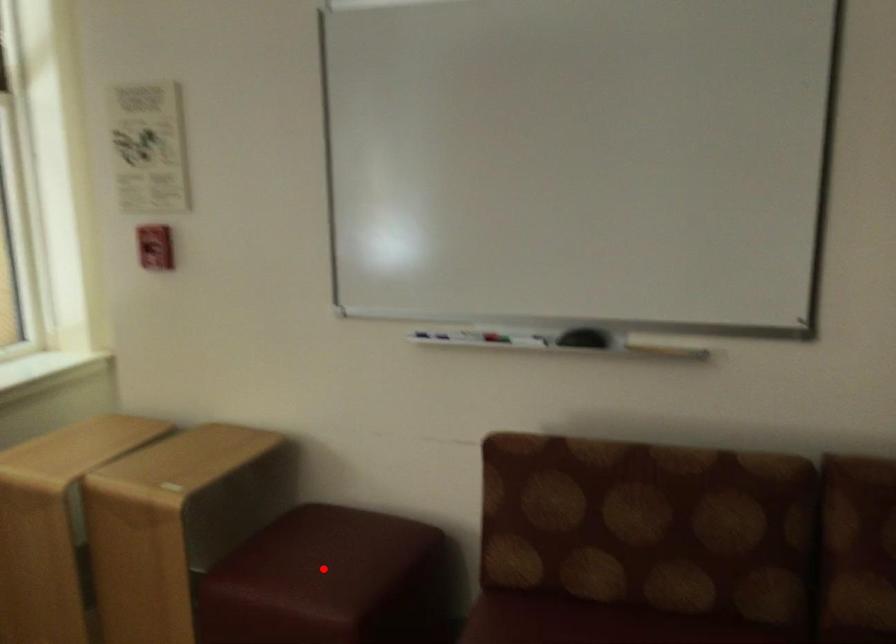
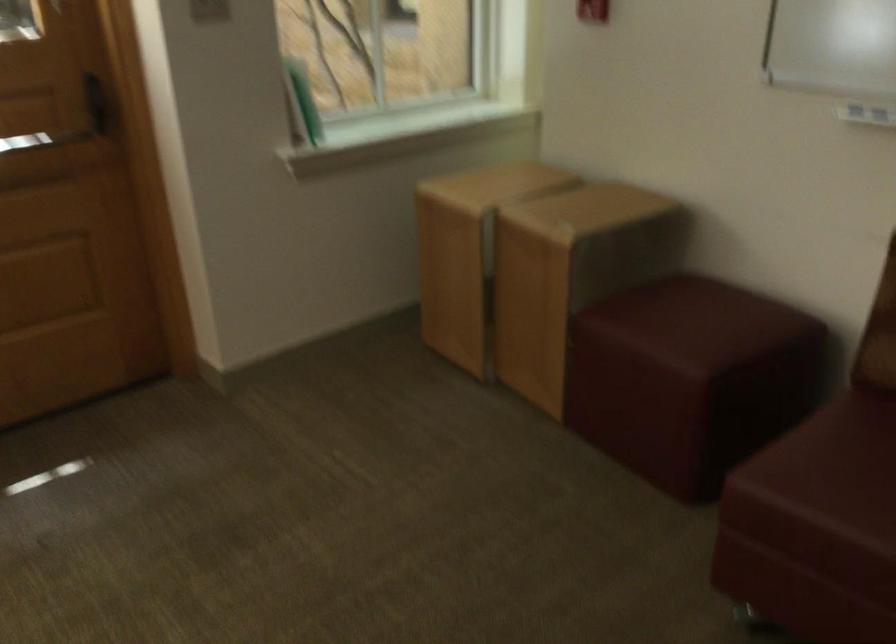
Locate, in the second image, the point that corresponds to the highlighted location in the first image.

(693, 325)